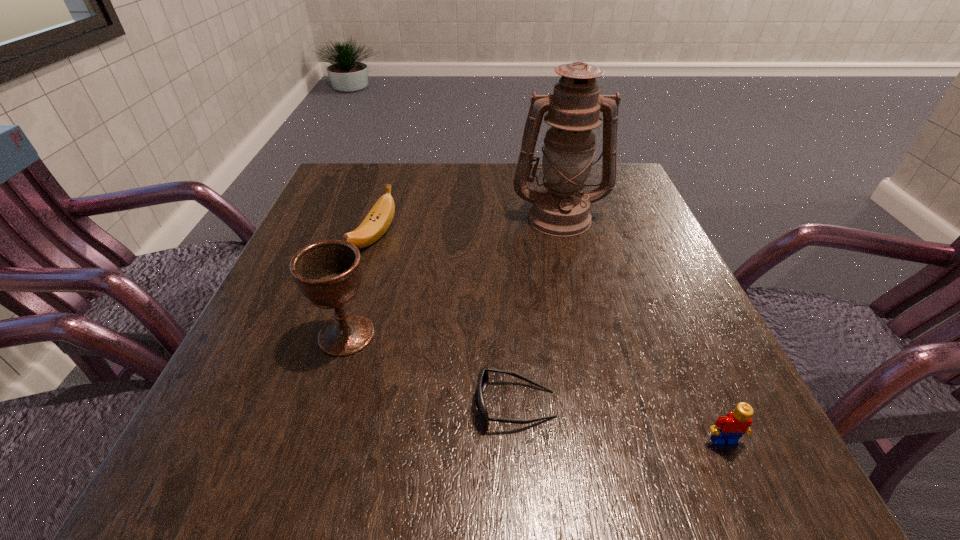
Locate an element on the screen. The width and height of the screenshot is (960, 540). blank space located on the back of the banana is located at coordinates (386, 197).

I want to click on vacant point located 0.070m on the front-facing side of the nearest object, so click(751, 503).

At what (x,y) coordinates should I click in order to perform the action: click on vacant space located on the front-facing side of the sunglasses. Please return your answer as a coordinate pair (x, y). Image resolution: width=960 pixels, height=540 pixels. Looking at the image, I should click on (392, 404).

Locate an element on the screen. vacant space located on the front-facing side of the sunglasses is located at coordinates (392, 404).

What are the coordinates of `free space located 0.140m on the front-facing side of the sunglasses` in the screenshot? It's located at (377, 404).

You are a GUI agent. You are given a task and a screenshot of the screen. Output one action in this format:
    pyautogui.click(x=<x>, y=<y>)
    Task: Click on the object that is at the far edge
    This screenshot has width=960, height=540.
    Given the screenshot: What is the action you would take?
    pyautogui.click(x=560, y=209)

Locate an element on the screen. This screenshot has width=960, height=540. object located at the near edge is located at coordinates (728, 429).

This screenshot has width=960, height=540. I want to click on chalice located at the left edge, so click(x=328, y=273).

I want to click on banana positioned at the left edge, so click(378, 220).

The image size is (960, 540). Find the location of `oil lamp present at the right edge`. oil lamp present at the right edge is located at coordinates (560, 209).